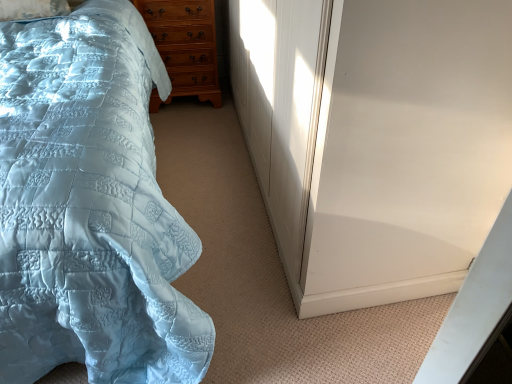
Question: Is white glossy screen door at right in front of light blue quilted bed at left?

Choices:
 (A) yes
 (B) no

Answer: (B)

Question: From a real-world perspective, does white glossy screen door at right stand above light blue quilted bed at left?

Choices:
 (A) yes
 (B) no

Answer: (B)

Question: Can you confirm if white glossy screen door at right is smaller than light blue quilted bed at left?

Choices:
 (A) no
 (B) yes

Answer: (B)

Question: From the image's perspective, does white glossy screen door at right appear lower than light blue quilted bed at left?

Choices:
 (A) no
 (B) yes

Answer: (A)

Question: Considering the relative sizes of white glossy screen door at right and light blue quilted bed at left in the image provided, is white glossy screen door at right bigger than light blue quilted bed at left?

Choices:
 (A) yes
 (B) no

Answer: (B)

Question: From their relative heights in the image, would you say white glossy screen door at right is taller or shorter than light blue quilted bed at left?

Choices:
 (A) tall
 (B) short

Answer: (B)

Question: From the image's perspective, is white glossy screen door at right positioned above or below light blue quilted bed at left?

Choices:
 (A) below
 (B) above

Answer: (B)

Question: Based on their sizes in the image, would you say white glossy screen door at right is bigger or smaller than light blue quilted bed at left?

Choices:
 (A) small
 (B) big

Answer: (A)

Question: Does point (361, 11) appear closer or farther from the camera than point (186, 380)?

Choices:
 (A) farther
 (B) closer

Answer: (B)

Question: Is light blue quilted bed at left to the left or to the right of light brown wooden chest of drawers at upper left in the image?

Choices:
 (A) right
 (B) left

Answer: (B)

Question: Considering the positions of point (51, 134) and point (155, 6), is point (51, 134) closer or farther from the camera than point (155, 6)?

Choices:
 (A) farther
 (B) closer

Answer: (B)

Question: Is light blue quilted bed at left situated inside light brown wooden chest of drawers at upper left or outside?

Choices:
 (A) outside
 (B) inside

Answer: (A)

Question: In terms of width, does light blue quilted bed at left look wider or thinner when compared to light brown wooden chest of drawers at upper left?

Choices:
 (A) thin
 (B) wide

Answer: (B)

Question: Considering the positions of point (423, 114) and point (195, 19), is point (423, 114) closer or farther from the camera than point (195, 19)?

Choices:
 (A) farther
 (B) closer

Answer: (B)

Question: Looking at the image, does white glossy screen door at right seem bigger or smaller compared to light brown wooden chest of drawers at upper left?

Choices:
 (A) small
 (B) big

Answer: (B)